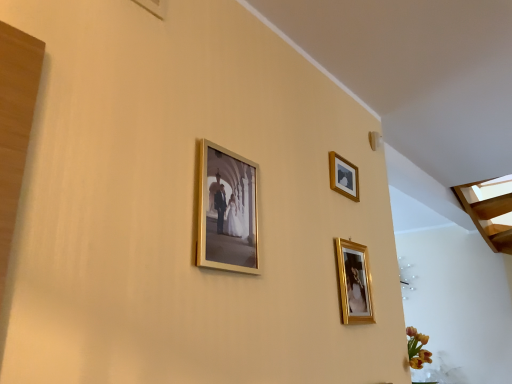
Question: Is wooden picture frame at upper right, arranged as the third picture frame when viewed from the front, further to the viewer compared to gold metallic picture frame at lower right, which appears as the second picture frame when viewed from the back?

Choices:
 (A) yes
 (B) no

Answer: (A)

Question: Considering the relative positions of wooden picture frame at upper right, arranged as the third picture frame when viewed from the front, and gold metallic picture frame at lower right, positioned as the third picture frame in left-to-right order, in the image provided, is wooden picture frame at upper right, arranged as the third picture frame when viewed from the front, to the left of gold metallic picture frame at lower right, positioned as the third picture frame in left-to-right order, from the viewer's perspective?

Choices:
 (A) no
 (B) yes

Answer: (B)

Question: Is wooden picture frame at upper right, the 2th picture frame when ordered from left to right, turned away from gold metallic picture frame at lower right, which is the first picture frame in right-to-left order?

Choices:
 (A) no
 (B) yes

Answer: (A)

Question: From a real-world perspective, is wooden picture frame at upper right, arranged as the third picture frame when viewed from the front, positioned over gold metallic picture frame at lower right, the 2th picture frame when ordered from front to back, based on gravity?

Choices:
 (A) no
 (B) yes

Answer: (B)

Question: From the image's perspective, is wooden picture frame at upper right, which is the first picture frame from back to front, located above gold metallic picture frame at lower right, the 2th picture frame when ordered from front to back?

Choices:
 (A) no
 (B) yes

Answer: (B)

Question: Considering the relative sizes of wooden picture frame at upper right, arranged as the third picture frame when viewed from the front, and gold metallic picture frame at lower right, the 2th picture frame when ordered from front to back, in the image provided, is wooden picture frame at upper right, arranged as the third picture frame when viewed from the front, shorter than gold metallic picture frame at lower right, the 2th picture frame when ordered from front to back,?

Choices:
 (A) yes
 (B) no

Answer: (A)

Question: Does wooden picture frame at upper right, the 2th picture frame when ordered from left to right, lie behind gold metallic photo frame at center, the first picture frame viewed from the front?

Choices:
 (A) yes
 (B) no

Answer: (A)

Question: From a real-world perspective, is wooden picture frame at upper right, the 2th picture frame when ordered from left to right, positioned under gold metallic photo frame at center, acting as the third picture frame starting from the right, based on gravity?

Choices:
 (A) no
 (B) yes

Answer: (A)

Question: Is the depth of wooden picture frame at upper right, the 2th picture frame when ordered from left to right, less than that of gold metallic photo frame at center, the first picture frame when ordered from left to right?

Choices:
 (A) no
 (B) yes

Answer: (A)

Question: Is wooden picture frame at upper right, arranged as the third picture frame when viewed from the front, located outside gold metallic photo frame at center, the first picture frame viewed from the front?

Choices:
 (A) no
 (B) yes

Answer: (B)

Question: Can you confirm if wooden picture frame at upper right, which is the first picture frame from back to front, is thinner than gold metallic photo frame at center, the first picture frame when ordered from left to right?

Choices:
 (A) yes
 (B) no

Answer: (A)

Question: Does wooden picture frame at upper right, arranged as the third picture frame when viewed from the front, have a larger size compared to gold metallic photo frame at center, arranged as the third picture frame when viewed from the back?

Choices:
 (A) no
 (B) yes

Answer: (A)

Question: Does gold metallic photo frame at center, acting as the third picture frame starting from the right, have a greater width compared to wooden picture frame at upper right, positioned as the 2th picture frame in right-to-left order?

Choices:
 (A) yes
 (B) no

Answer: (A)